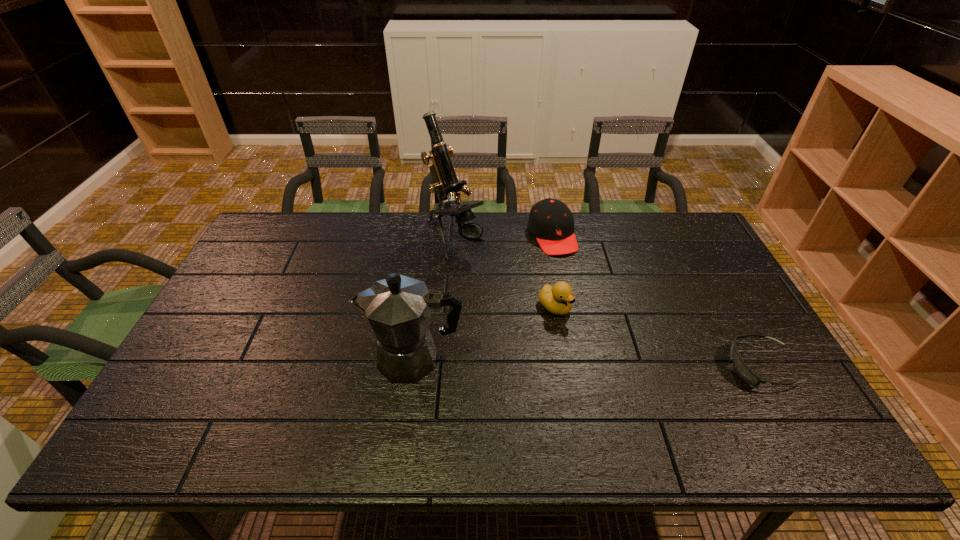
Where is `free space on the desktop that is between the second tallest object and the shortest object and is positioned through the eyepiece of the tallest object`? free space on the desktop that is between the second tallest object and the shortest object and is positioned through the eyepiece of the tallest object is located at coordinates (577, 363).

You are a GUI agent. You are given a task and a screenshot of the screen. Output one action in this format:
    pyautogui.click(x=<x>, y=<y>)
    Task: Click on the vacant space on the desktop that is between the fourth shortest object and the goggles and is positioned on the face of the third nearest object
    The image size is (960, 540).
    Given the screenshot: What is the action you would take?
    pyautogui.click(x=626, y=364)

This screenshot has height=540, width=960. In order to click on free spot on the desktop that is between the coffeepot and the shortest object and is positioned on the front-facing side of the cap in this screenshot , I will do `click(622, 364)`.